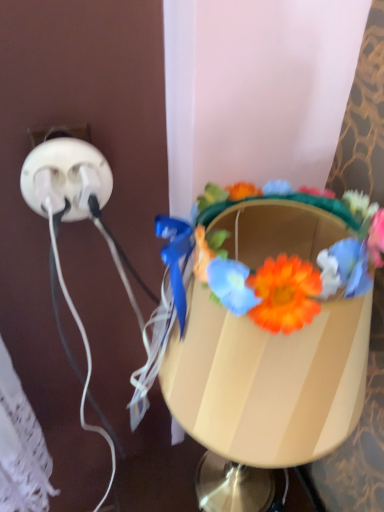
Question: From the image's perspective, relative to floral crown at center, is matte plastic table lamp at center above or below?

Choices:
 (A) below
 (B) above

Answer: (A)

Question: In the image, is matte plastic table lamp at center positioned in front of or behind floral crown at center?

Choices:
 (A) behind
 (B) front

Answer: (B)

Question: Estimate the real-world distances between objects in this image. Which object is farther from the floral crown at center?

Choices:
 (A) white plastic power plugs at left
 (B) matte plastic table lamp at center

Answer: (A)

Question: Estimate the real-world distances between objects in this image. Which object is farther from the matte plastic table lamp at center?

Choices:
 (A) white plastic power plugs at left
 (B) floral crown at center

Answer: (A)